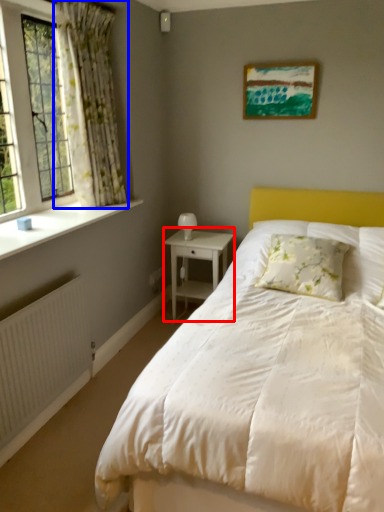
Question: Which object appears closest to the camera in this image, nightstand (highlighted by a red box) or curtain (highlighted by a blue box)?

Choices:
 (A) nightstand
 (B) curtain

Answer: (B)